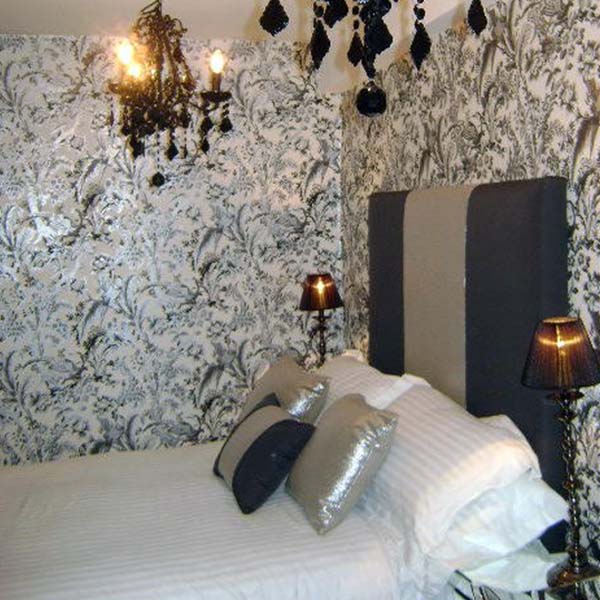
The image size is (600, 600). I want to click on lamp, so [x=336, y=291].